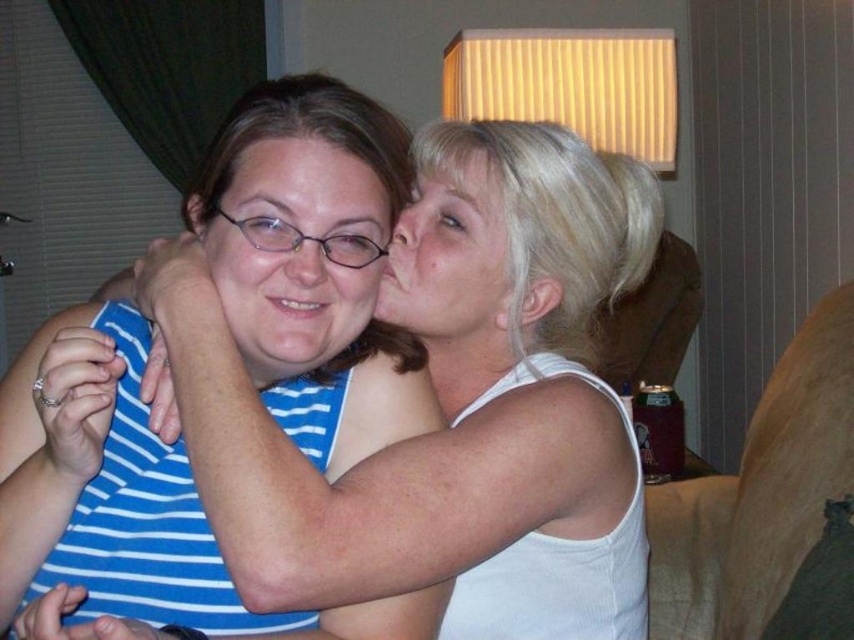
Who is positioned more to the right, matte blue striped shirt at center or matte white face at upper right?

Positioned to the right is matte white face at upper right.

From the picture: Is matte blue striped shirt at center to the right of matte white face at upper right from the viewer's perspective?

No, matte blue striped shirt at center is not to the right of matte white face at upper right.

Which is in front, point (317, 273) or point (471, 244)?

Positioned in front is point (317, 273).

Where is `matte blue striped shirt at center`? Image resolution: width=854 pixels, height=640 pixels. matte blue striped shirt at center is located at coordinates (297, 250).

Can you confirm if white matte tank top at center is taller than matte white face at upper right?

Yes.

Which is behind, point (430, 445) or point (396, 253)?

Positioned behind is point (396, 253).

Which is in front, point (559, 577) or point (428, 227)?

Point (559, 577) is in front.

What are the coordinates of `white matte tank top at center` in the screenshot? It's located at (445, 403).

Is white matte tank top at center closer to the viewer compared to matte blue striped shirt at center?

Yes, it is.

Which is above, white matte tank top at center or matte blue striped shirt at center?

Positioned higher is matte blue striped shirt at center.

Find the location of `white matte tank top at center`. white matte tank top at center is located at coordinates (445, 403).